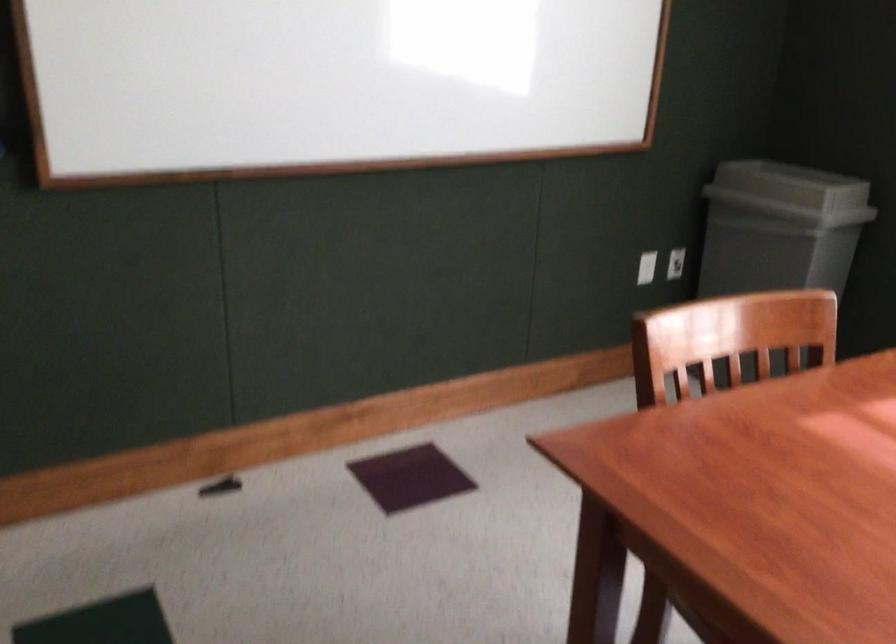
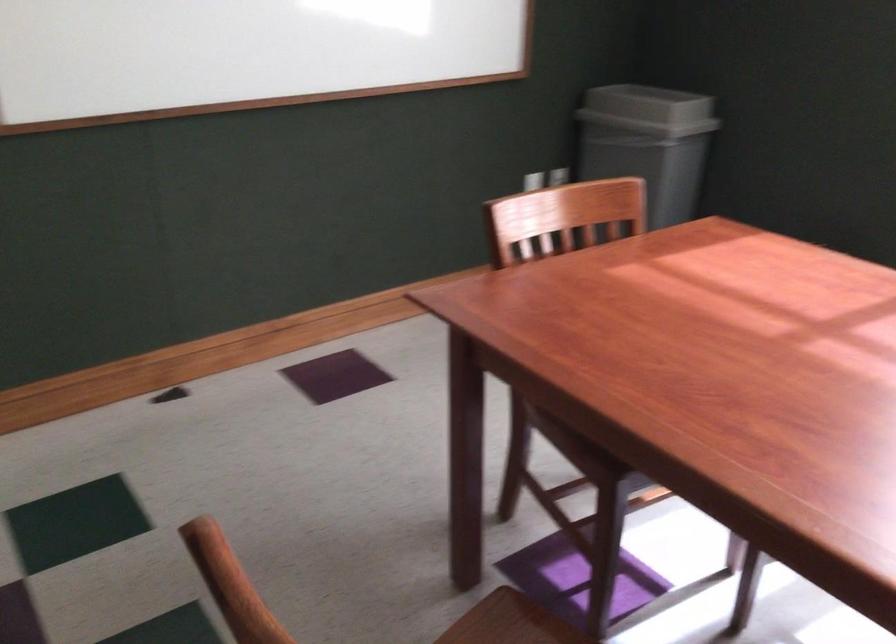
Where in the second image is the point corresponding to (800,192) from the first image?

(648, 109)